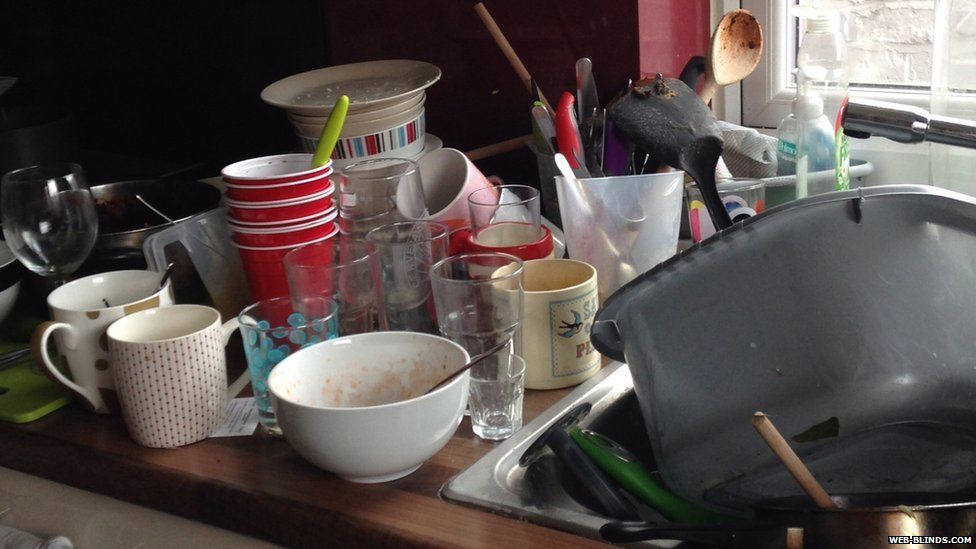
Image resolution: width=976 pixels, height=549 pixels. Identify the location of coffee cups. (565, 320), (172, 369), (88, 320).